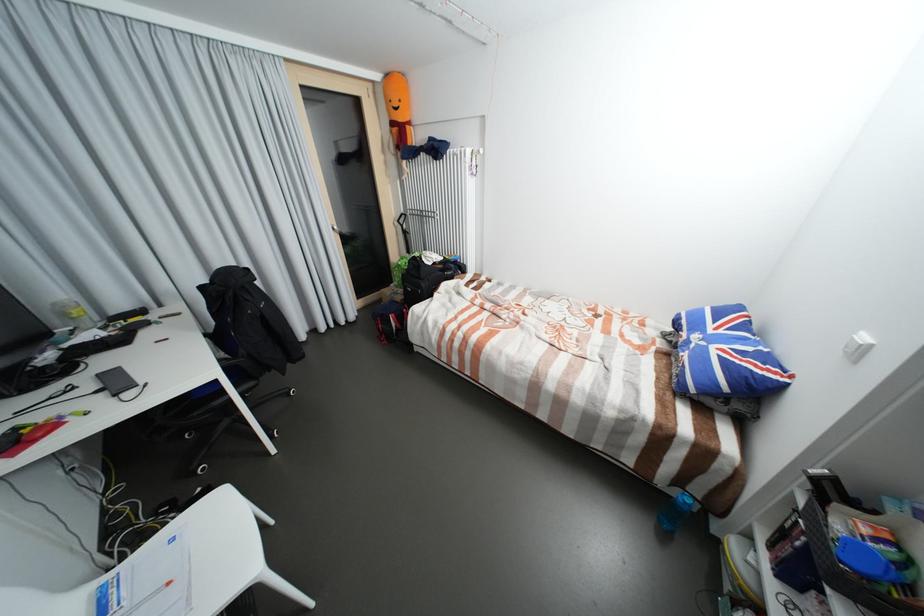
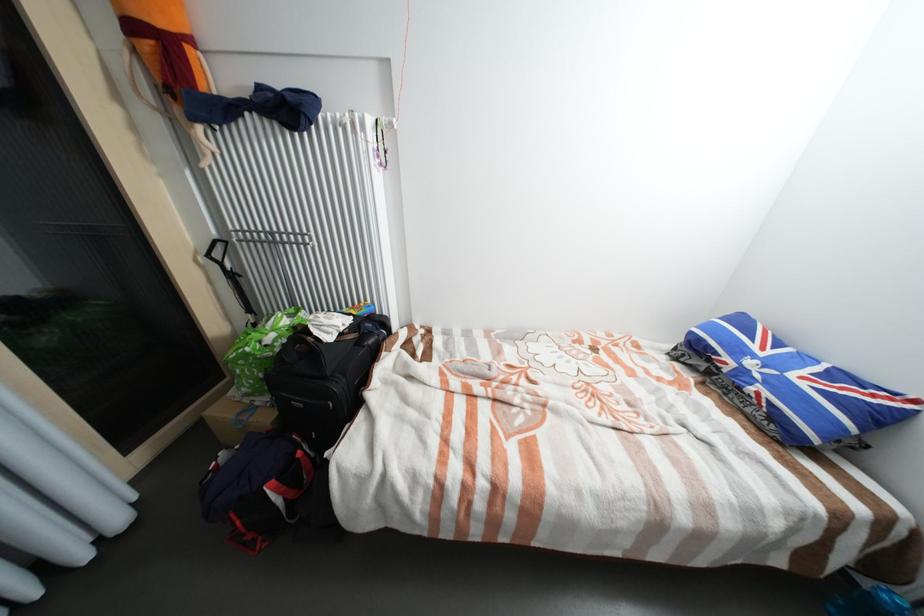
Where in the second image is the point corresponding to pixel 403 286 from the first image?

(253, 395)